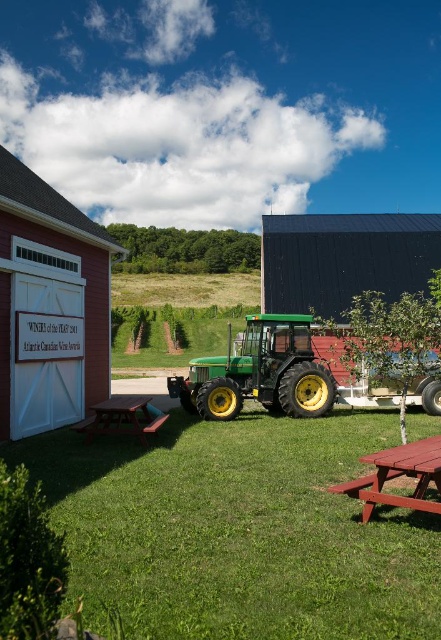
Question: Which object appears closest to the camera in this image?

Choices:
 (A) brown wooden picnic table at lower left
 (B) red wood picnic table at lower right
 (C) green matte tractor at center

Answer: (B)

Question: Estimate the real-world distances between objects in this image. Which object is closer to the green grass at center?

Choices:
 (A) dark gray corrugated metal barn at center
 (B) red wood picnic table at lower right

Answer: (B)

Question: Can you confirm if green matte tractor at center is positioned below red wood picnic table at lower right?

Choices:
 (A) yes
 (B) no

Answer: (B)

Question: Estimate the real-world distances between objects in this image. Which object is closer to the dark gray corrugated metal barn at center?

Choices:
 (A) red wood picnic table at lower right
 (B) matte white barn at left
 (C) green matte tractor at center

Answer: (C)

Question: Is green grass at center wider than green matte tractor at center?

Choices:
 (A) yes
 (B) no

Answer: (B)

Question: Does dark gray corrugated metal barn at center have a greater width compared to red wood picnic table at lower right?

Choices:
 (A) yes
 (B) no

Answer: (A)